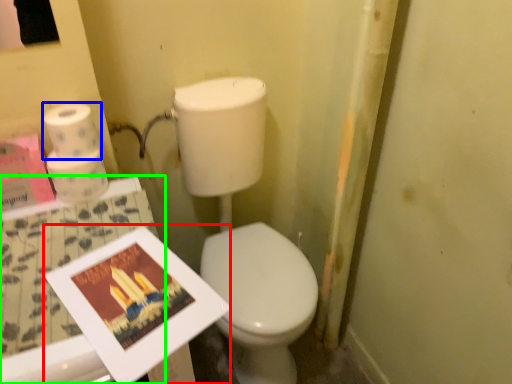
Question: Which object is the farthest from magazine (highlighted by a red box)? Choose among these: toilet paper (highlighted by a blue box) or table (highlighted by a green box).

Choices:
 (A) toilet paper
 (B) table

Answer: (A)